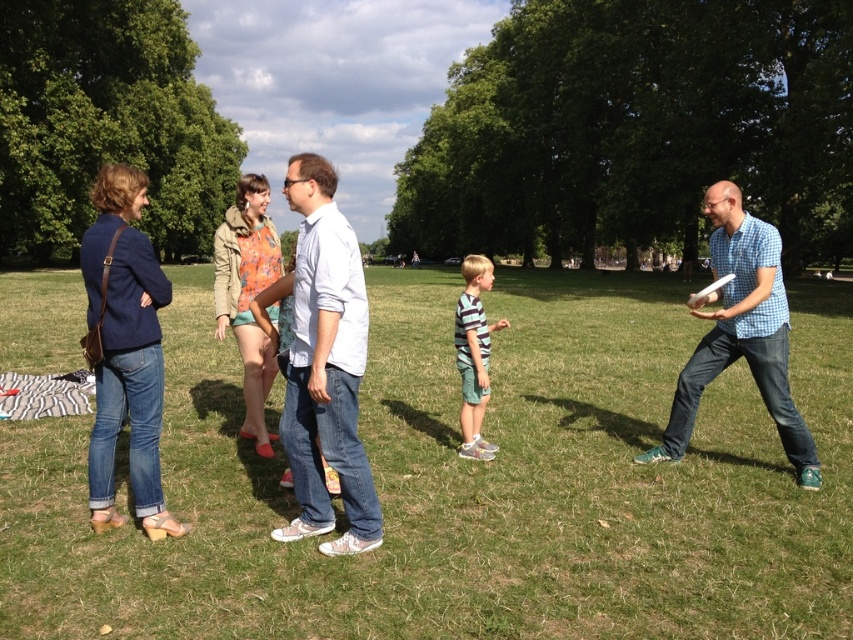
Which is behind, point (445, 547) or point (306, 243)?

The point (445, 547) is behind.

Can you confirm if green grassy field at center is bigger than light blue cotton shirt at center?

Yes, green grassy field at center is bigger than light blue cotton shirt at center.

Image resolution: width=853 pixels, height=640 pixels. What do you see at coordinates (467, 483) in the screenshot? I see `green grassy field at center` at bounding box center [467, 483].

Image resolution: width=853 pixels, height=640 pixels. Find the location of `green grassy field at center`. green grassy field at center is located at coordinates (467, 483).

What do you see at coordinates (467, 483) in the screenshot?
I see `green grassy field at center` at bounding box center [467, 483].

Is green grassy field at center to the left of navy blue denim jacket at left from the viewer's perspective?

Incorrect, green grassy field at center is not on the left side of navy blue denim jacket at left.

Describe the element at coordinates (467, 483) in the screenshot. I see `green grassy field at center` at that location.

This screenshot has height=640, width=853. Identify the location of green grassy field at center. (467, 483).

Is denim jeans at center to the right of navy blue denim jacket at left from the viewer's perspective?

Indeed, denim jeans at center is positioned on the right side of navy blue denim jacket at left.

Does point (103, 417) come farther from viewer compared to point (96, 461)?

No, it is in front of (96, 461).

Who is more forward, (113,262) or (134,333)?

Point (113,262) is more forward.

This screenshot has height=640, width=853. I want to click on denim jeans at center, so click(x=125, y=346).